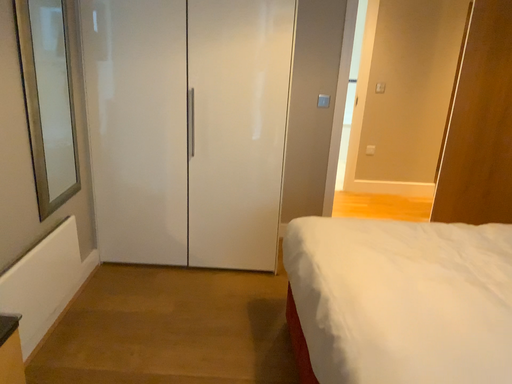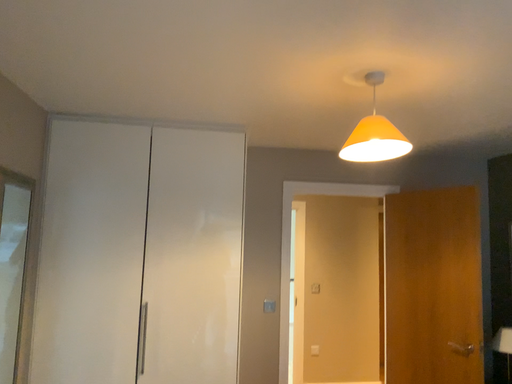
Question: How did the camera likely rotate when shooting the video?

Choices:
 (A) rotated upward
 (B) rotated downward

Answer: (A)